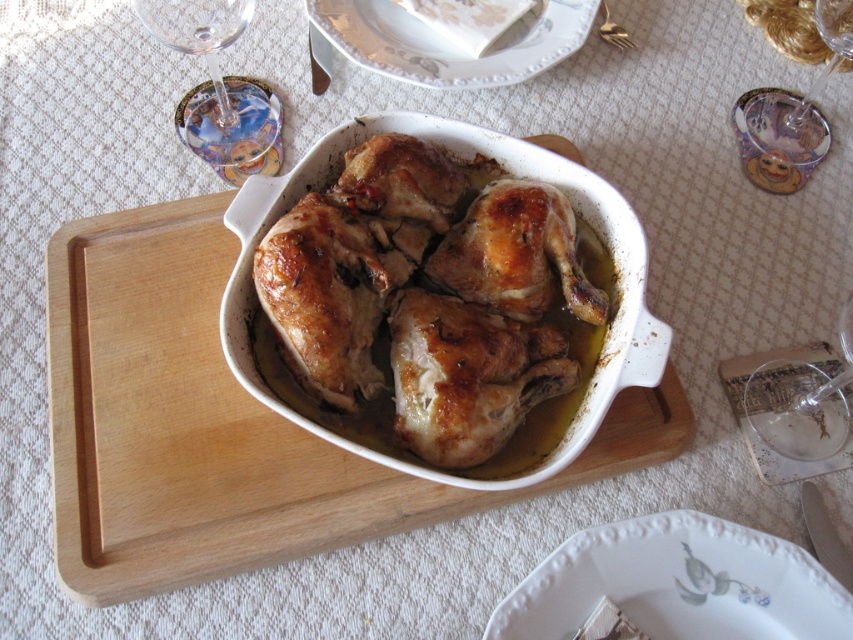
Question: Which object appears farthest from the camera in this image?

Choices:
 (A) transparent glass at lower right
 (B) transparent glass at upper right
 (C) golden crispy chicken at center
 (D) white porcelain plate at lower center

Answer: (B)

Question: In this image, where is white porcelain plate at upper center located relative to transparent glass at lower right?

Choices:
 (A) above
 (B) below

Answer: (A)

Question: Which of the following is the farthest from the observer?

Choices:
 (A) transparent glass at upper right
 (B) golden crispy chicken at center
 (C) transparent glass at upper left
 (D) white porcelain plate at upper center

Answer: (D)

Question: Which point appears farthest from the camera in this image?

Choices:
 (A) (624, 35)
 (B) (793, 452)
 (C) (550, 51)
 (D) (755, 625)

Answer: (A)

Question: Does golden crispy chicken at center have a lesser width compared to white porcelain plate at lower center?

Choices:
 (A) no
 (B) yes

Answer: (A)

Question: Does white porcelain plate at lower center have a greater width compared to transparent glass at lower right?

Choices:
 (A) yes
 (B) no

Answer: (A)